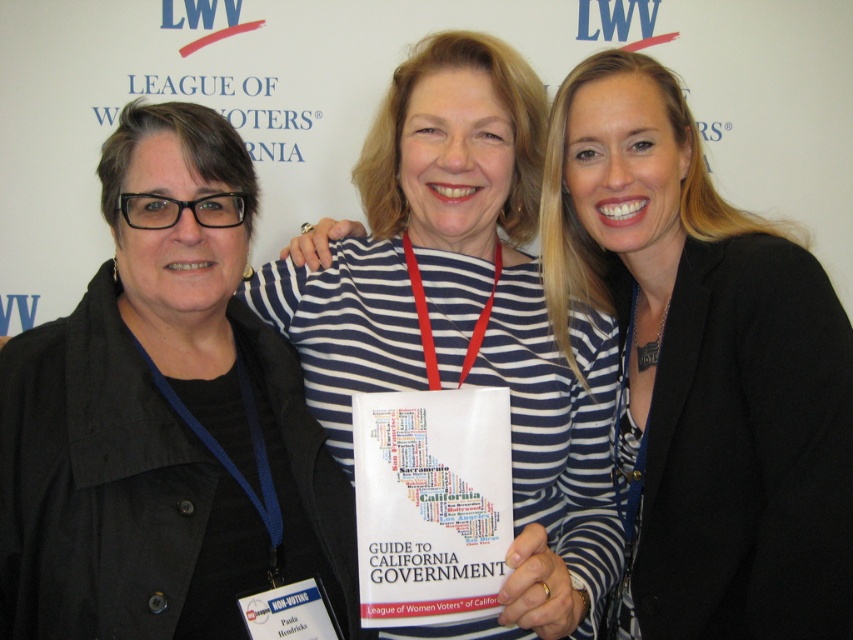
You are a photographer setting up for a group photo. You need to position the black matte jacket at left and the striped fabric shirt at center correctly. According to the scene description, which object should be placed to the left side of the other?

The black matte jacket at left should be placed to the left of the striped fabric shirt at center because the description states that the black matte jacket at left is to the left of the striped fabric shirt at center.

You are a photographer setting up for a group photo. You notice the black matte jacket at left and the striped fabric shirt at center. Which object is positioned closer to you?

The black matte jacket at left is closer to the viewer than the striped fabric shirt at center.